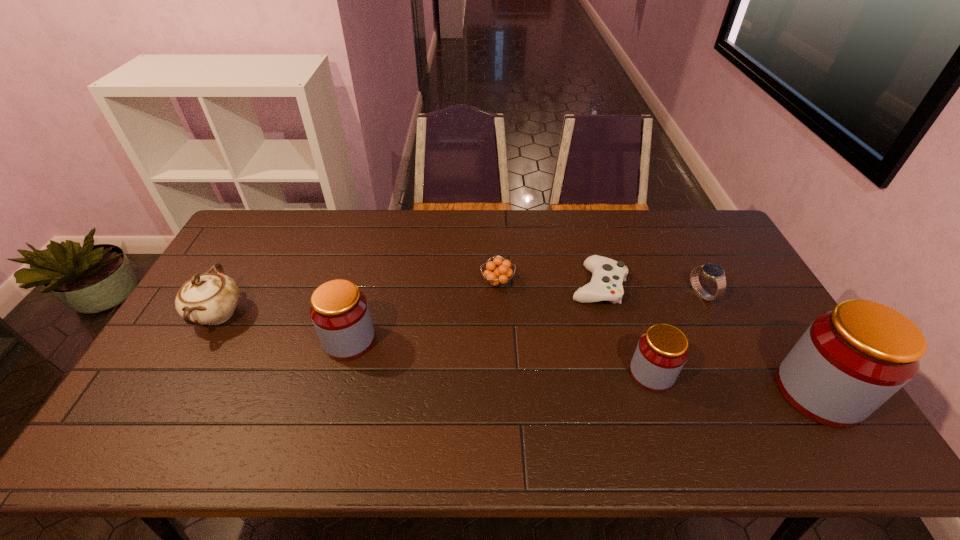
You are a GUI agent. You are given a task and a screenshot of the screen. Output one action in this format:
    pyautogui.click(x=<x>, y=<y>)
    Task: Click on the second object from left to right
    
    Given the screenshot: What is the action you would take?
    pyautogui.click(x=339, y=311)

This screenshot has height=540, width=960. In order to click on the second shortest jar in this screenshot , I will do `click(339, 311)`.

Image resolution: width=960 pixels, height=540 pixels. What are the coordinates of `the shortest jar` in the screenshot? It's located at (662, 350).

At what (x,y) coordinates should I click in order to perform the action: click on the rightmost object. Please return your answer as a coordinate pair (x, y). This screenshot has height=540, width=960. Looking at the image, I should click on (852, 359).

Image resolution: width=960 pixels, height=540 pixels. I want to click on the tallest object, so click(x=852, y=359).

The width and height of the screenshot is (960, 540). Identify the location of chinaware. pyautogui.click(x=210, y=298).

The width and height of the screenshot is (960, 540). I want to click on orange fruit, so click(x=498, y=276).

Image resolution: width=960 pixels, height=540 pixels. Find the location of `control`. control is located at coordinates (608, 275).

Find the location of `the sixth object from left to right`. the sixth object from left to right is located at coordinates (711, 271).

Locate an element on the screen. watch is located at coordinates (x=711, y=271).